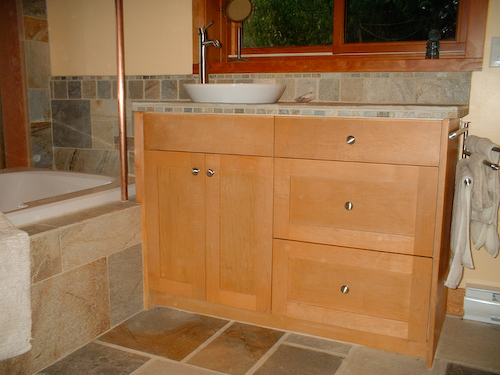
At what (x,y) coordinates should I click in order to perform the action: click on wooden under sink cabinet. Please return your answer as a coordinate pair (x, y). This screenshot has width=500, height=375. Looking at the image, I should click on [x=252, y=183].